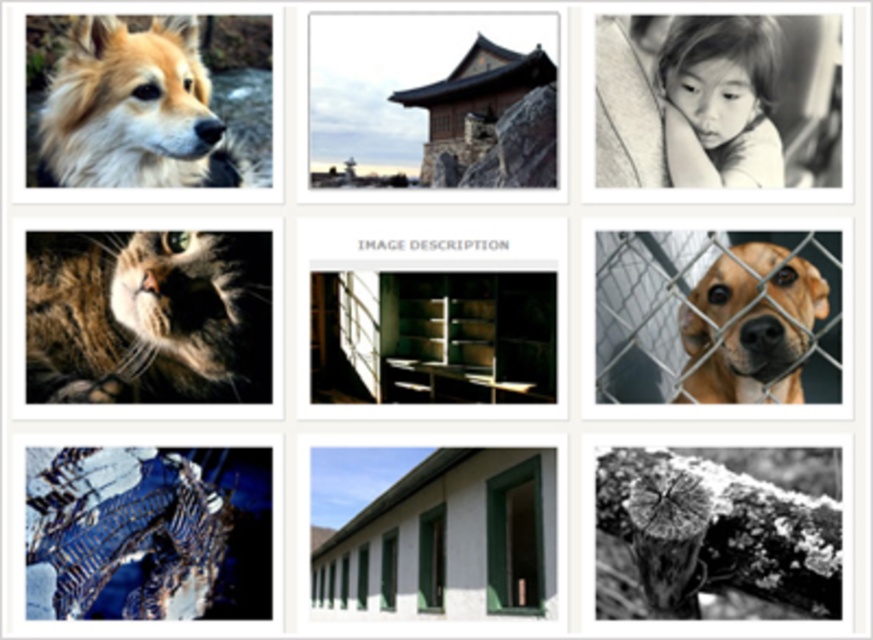
Question: Which point is farther to the camera?

Choices:
 (A) (768, 332)
 (B) (93, 387)
 (C) (478, 320)

Answer: (C)

Question: Does fuzzy brown fur at upper left have a larger size compared to brown furry dog at center right?

Choices:
 (A) yes
 (B) no

Answer: (B)

Question: Among these points, which one is nearest to the camera?

Choices:
 (A) (87, 273)
 (B) (689, 92)

Answer: (A)

Question: Does tabby fur cat at upper left have a lesser width compared to brown furry dog at center right?

Choices:
 (A) yes
 (B) no

Answer: (B)

Question: Can you confirm if fuzzy brown fur at upper left is smaller than smooth skin child at upper right?

Choices:
 (A) no
 (B) yes

Answer: (A)

Question: Which is farther from the fuzzy brown fur at upper left?

Choices:
 (A) brown furry dog at center right
 (B) tabby fur cat at upper left
 (C) smooth skin child at upper right
 (D) wooden shelves at center

Answer: (D)